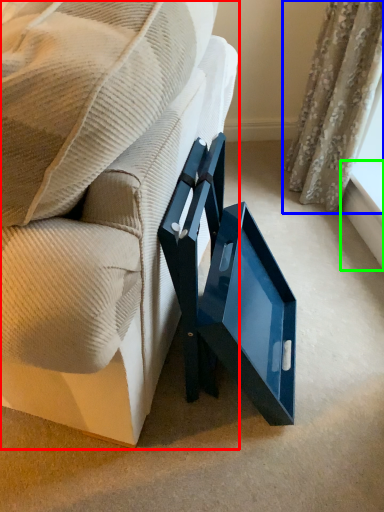
Question: Considering the real-world distances, which object is closest to furniture (highlighted by a red box)? curtain (highlighted by a blue box) or window sill (highlighted by a green box).

Choices:
 (A) curtain
 (B) window sill

Answer: (A)